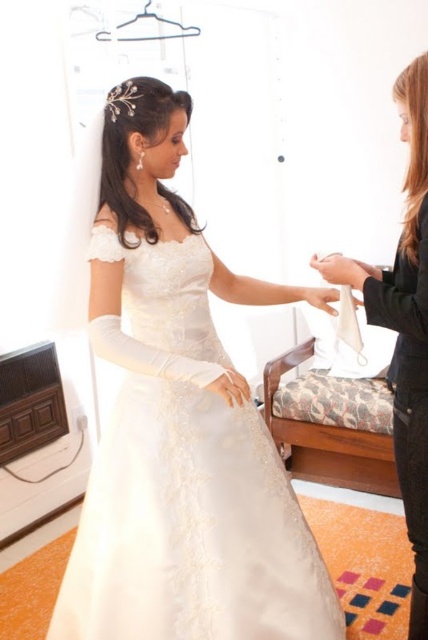
You are a photographer at a wedding fitting session. You need to position the camera so both the satin dress at center and the silky black dress at center are in frame. Which dress should you focus on first to ensure proper framing?

The satin dress at center is much taller than the silky black dress at center, so you should focus on the satin dress at center first to ensure it is properly framed within the camera view.

You are a photographer at a wedding venue and need to position the satin dress at center and the silky black dress at center for a photo. According to the scene, which dress should be placed to the left to match the original arrangement?

The satin dress at center should be placed to the left of the silky black dress at center because the satin dress at center is positioned on the left side of silky black dress at center in the original scene.

You are a photographer setting up for a photoshoot. You need to position a light source between the satin dress at center and the silky black dress at center. Given that the dresses are 21 inches apart, what is the minimum width of the light stand that can fit between them without touching either dress?

The satin dress at center and silky black dress at center are 21.00 inches apart from each other. Therefore, the minimum width of the light stand should be less than 21 inches to fit between them without touching either dress.